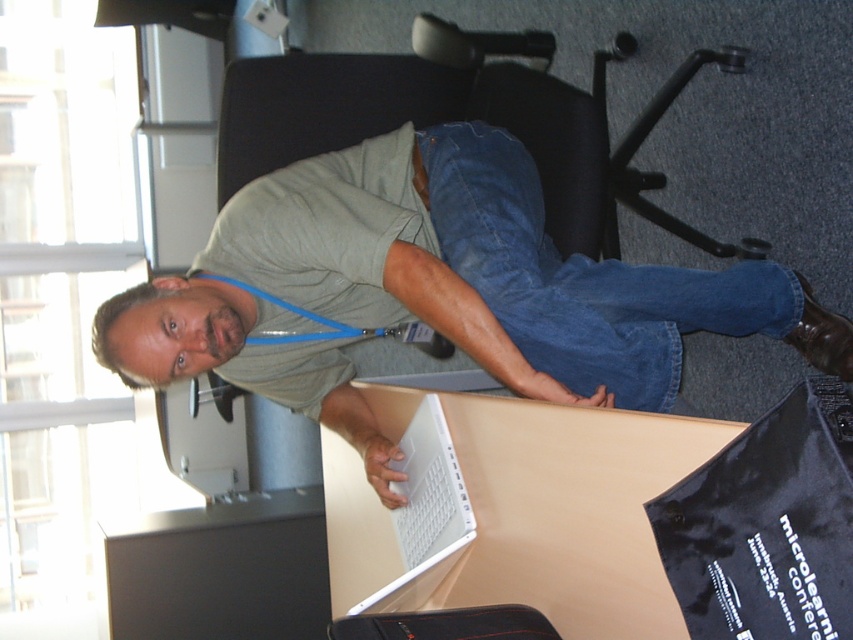
Question: Among these points, which one is farthest from the camera?

Choices:
 (A) click(x=149, y=285)
 (B) click(x=683, y=83)

Answer: (B)

Question: Is black plastic swivel chair at upper center smaller than white glossy laptop at center?

Choices:
 (A) no
 (B) yes

Answer: (A)

Question: Does denim at center have a greater width compared to black plastic swivel chair at upper center?

Choices:
 (A) yes
 (B) no

Answer: (B)

Question: Considering the real-world distances, which object is closest to the black plastic swivel chair at upper center?

Choices:
 (A) white glossy laptop at center
 (B) denim at center
 (C) matte gray shirt at center

Answer: (B)

Question: Which object is closer to the camera taking this photo?

Choices:
 (A) denim at center
 (B) white glossy laptop at center
 (C) black plastic swivel chair at upper center

Answer: (B)

Question: Can you confirm if denim at center is wider than white glossy laptop at center?

Choices:
 (A) yes
 (B) no

Answer: (A)